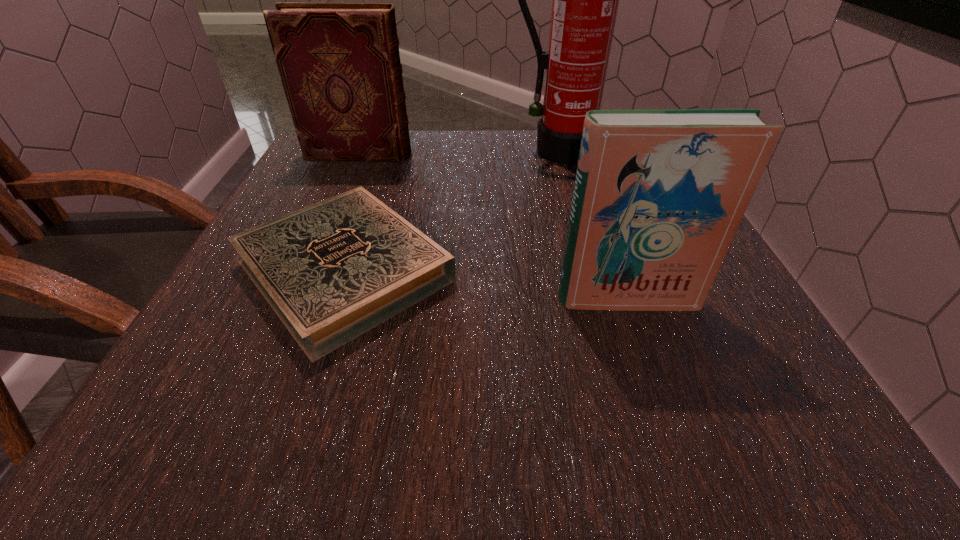
Point out which hardback book is positioned as the nearest to the shortest hardback book. Please provide its 2D coordinates. Your answer should be formatted as a tuple, i.e. [(x, y)], where the tuple contains the x and y coordinates of a point satisfying the conditions above.

[(659, 194)]

Locate an element on the screen. The width and height of the screenshot is (960, 540). vacant region that satisfies the following two spatial constraints: 1. on the back side of the shortest hardback book; 2. on the spine side of the farthest hardback book is located at coordinates (384, 154).

You are a GUI agent. You are given a task and a screenshot of the screen. Output one action in this format:
    pyautogui.click(x=<x>, y=<y>)
    Task: Click on the free spot that satisfies the following two spatial constraints: 1. on the spine side of the shortest hardback book; 2. on the right side of the farthest hardback book
    This screenshot has width=960, height=540.
    Given the screenshot: What is the action you would take?
    pyautogui.click(x=309, y=271)

Locate an element on the screen. The image size is (960, 540). free location that satisfies the following two spatial constraints: 1. on the spine side of the shortest object; 2. on the right side of the farthest hardback book is located at coordinates (309, 271).

This screenshot has height=540, width=960. Identify the location of vacant area that satisfies the following two spatial constraints: 1. on the front-facing side of the tallest object; 2. on the spine side of the farthest hardback book. (556, 154).